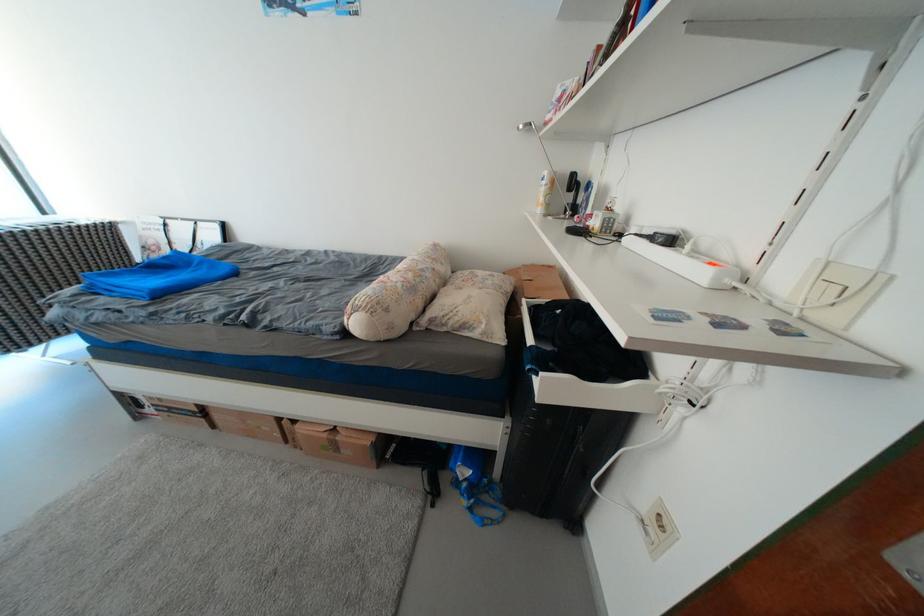
Describe the element at coordinates (824, 296) in the screenshot. I see `the white light switch` at that location.